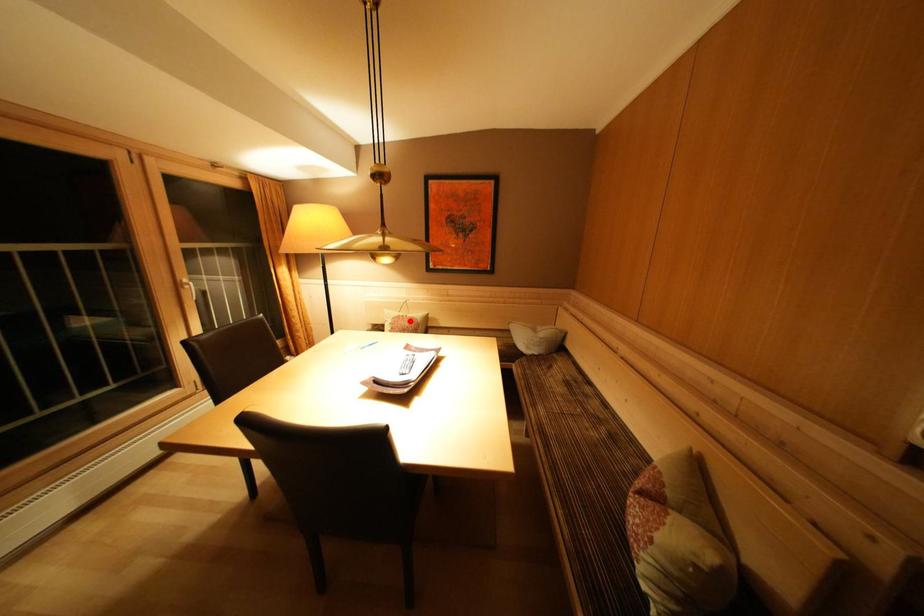
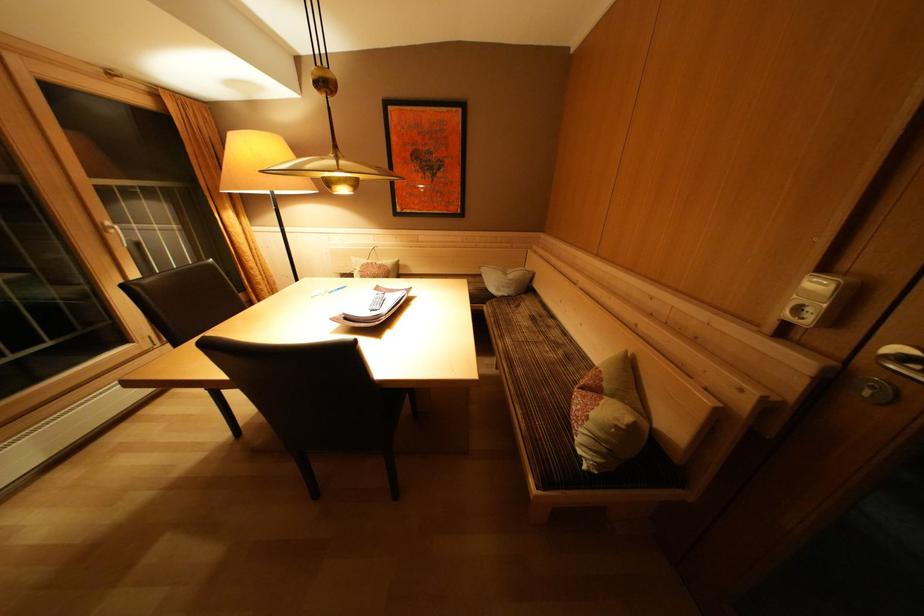
Question: I am providing you with two images of the same scene from different viewpoints. In image1, a red point is highlighted. Considering the same 3D point in image2, which of the following is correct?

Choices:
 (A) It is closer
 (B) It is farther

Answer: (A)